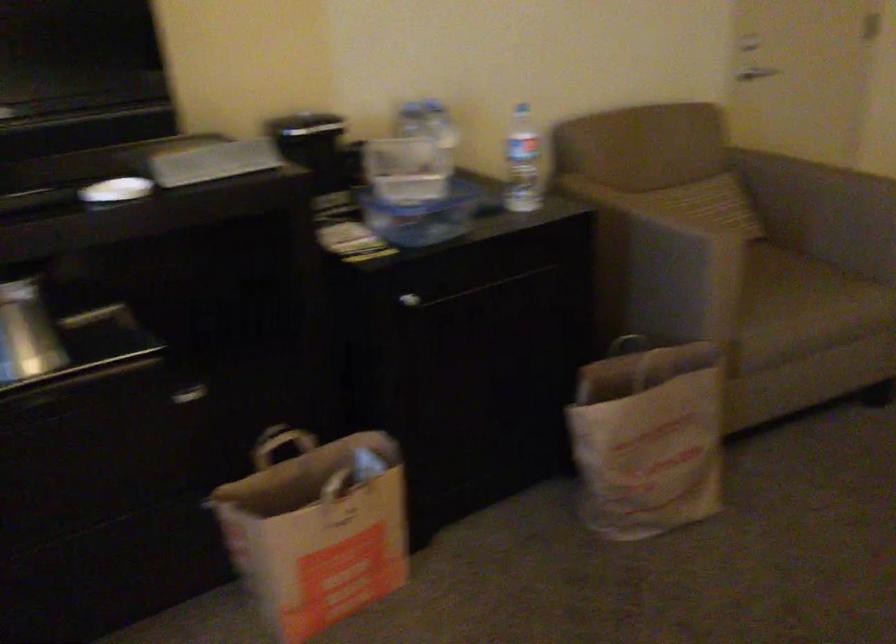
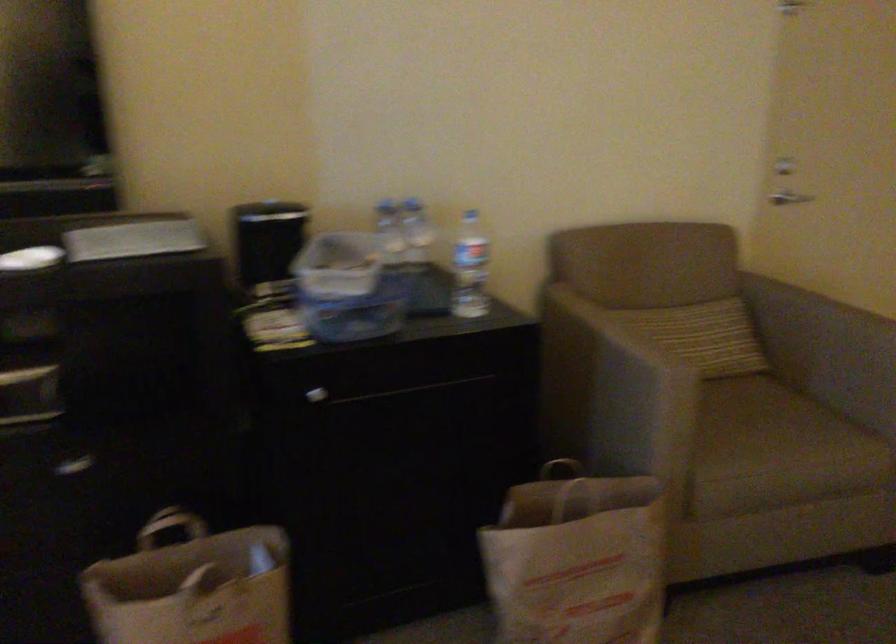
Find the pixel in the second image that matches pixel 779 277 in the first image.

(762, 418)